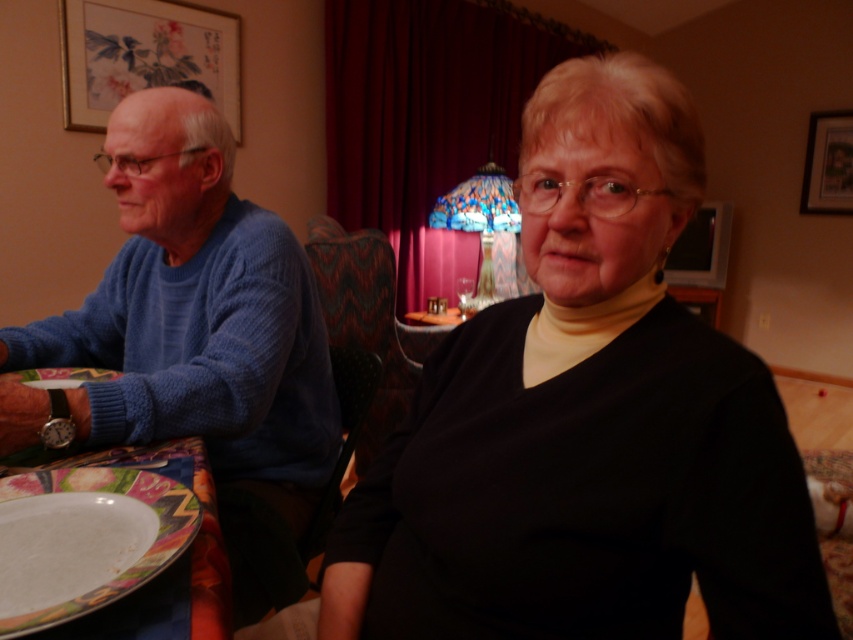
Question: From the image, what is the correct spatial relationship of gold-framed picture at upper left in relation to wooden picture frame at upper right?

Choices:
 (A) below
 (B) above

Answer: (A)

Question: Which point is closer to the camera taking this photo?

Choices:
 (A) pyautogui.click(x=561, y=516)
 (B) pyautogui.click(x=181, y=77)

Answer: (A)

Question: In this image, where is white glossy plate at lower left located relative to wooden picture frame at upper right?

Choices:
 (A) above
 (B) below

Answer: (B)

Question: Is gold-framed picture at upper left below wooden picture frame at upper right?

Choices:
 (A) yes
 (B) no

Answer: (A)

Question: Which point is farther to the camera?

Choices:
 (A) (726, 588)
 (B) (91, 477)
 (C) (128, 420)
 (D) (125, 36)

Answer: (D)

Question: Considering the real-world distances, which object is closest to the black matte sweater at center?

Choices:
 (A) gold-framed picture at upper left
 (B) blue knitted sweater at left

Answer: (B)